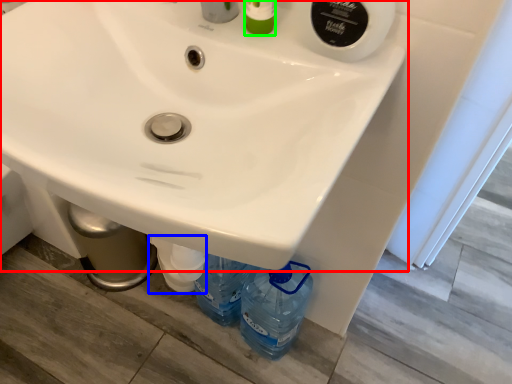
Question: Which is farther away from sink (highlighted by a red box)? bottle (highlighted by a blue box) or toiletry (highlighted by a green box)?

Choices:
 (A) bottle
 (B) toiletry

Answer: (A)